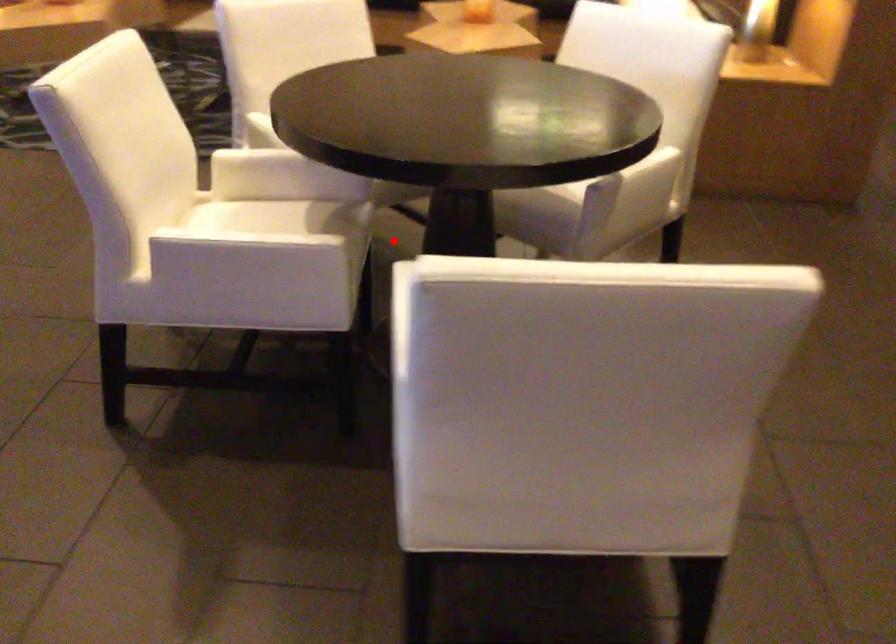
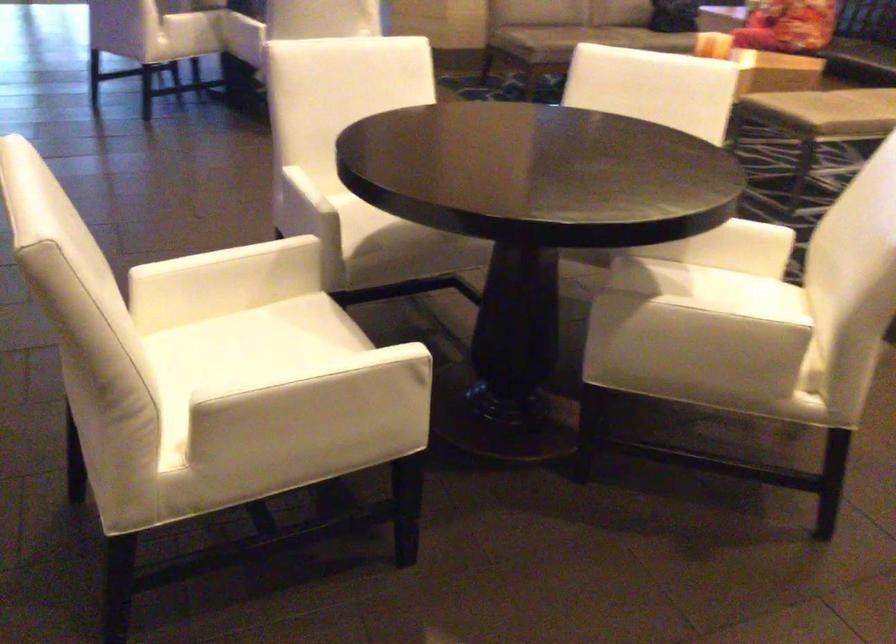
Question: I am providing you with two images of the same scene from different viewpoints. A red point is marked on the first image. At the location where the point appears in image 1, is it still visible in image 2?

Choices:
 (A) Yes
 (B) No

Answer: (B)